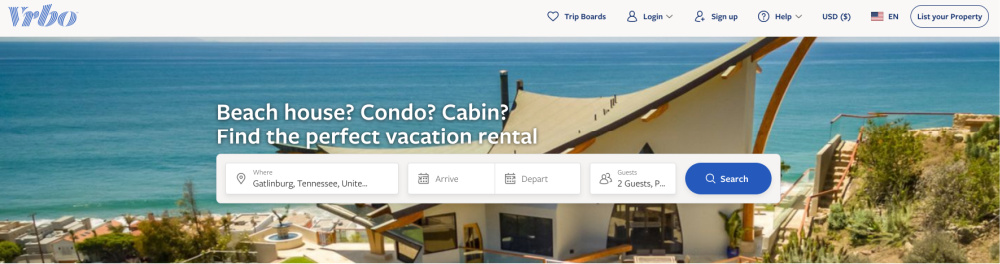
Identify the location of window. (439, 221).